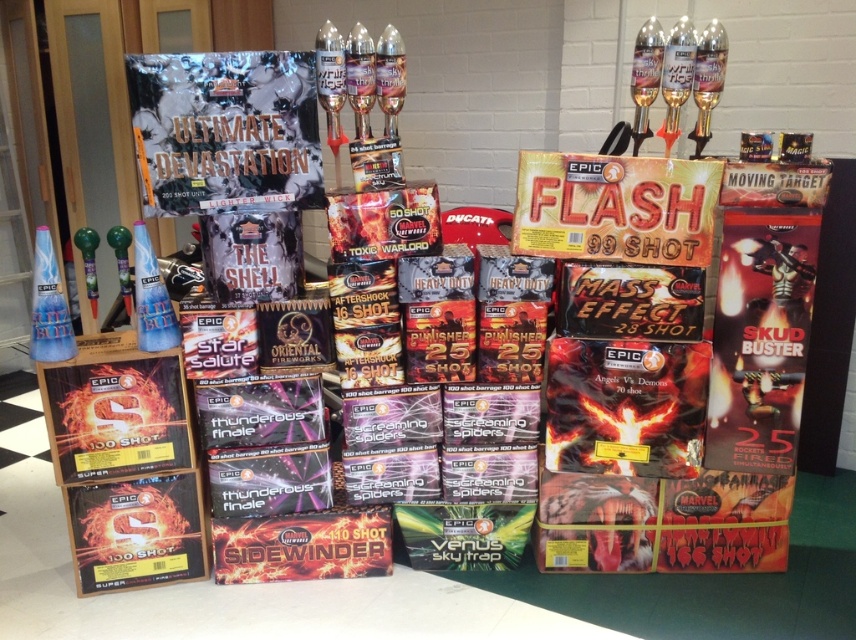
Which is more to the left, matte black comic book at upper left or matte black box at lower left?

matte black box at lower left

Does matte black comic book at upper left have a lesser width compared to matte black box at lower left?

Incorrect, matte black comic book at upper left's width is not less than matte black box at lower left's.

Between point (260, 52) and point (128, 401), which one is positioned in front?

Point (260, 52)

You are a GUI agent. You are given a task and a screenshot of the screen. Output one action in this format:
    pyautogui.click(x=<x>, y=<y>)
    Task: Click on the matte black comic book at upper left
    
    Given the screenshot: What is the action you would take?
    pyautogui.click(x=224, y=129)